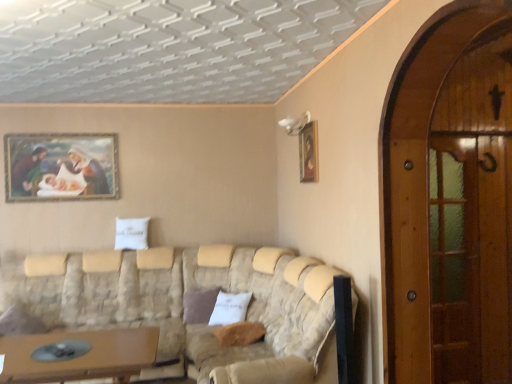
What do you see at coordinates (61, 167) in the screenshot? I see `wooden framed painting at upper left, acting as the 1th picture frame starting from the left` at bounding box center [61, 167].

You are a GUI agent. You are given a task and a screenshot of the screen. Output one action in this format:
    pyautogui.click(x=<x>, y=<y>)
    Task: Click on the wooden screen door at right, which is counted as the first screen door, starting from the right
    The height and width of the screenshot is (384, 512).
    Given the screenshot: What is the action you would take?
    pyautogui.click(x=454, y=258)

Describe the element at coordinates (309, 152) in the screenshot. The height and width of the screenshot is (384, 512). I see `wooden picture frame at upper right, which appears as the 1th picture frame when viewed from the front` at that location.

I want to click on brown plush pillow at center, which is the second pillow from left to right, so click(239, 333).

This screenshot has width=512, height=384. In order to click on beige fabric couch at lower center in this screenshot , I will do `click(265, 316)`.

What is the approximate width of textured beige couch at center?

textured beige couch at center is 2.29 meters wide.

Measure the distance between textured beige couch at center and camera.

They are 2.49 meters apart.

What do you see at coordinates (199, 305) in the screenshot? I see `brown fabric pillow at center, which appears as the second pillow when viewed from the front` at bounding box center [199, 305].

Measure the distance between point (200, 299) and camera.

The depth of point (200, 299) is 4.18 meters.

The image size is (512, 384). Identify the location of wooden framed painting at upper left, the second picture frame positioned from the front. (61, 167).

Is beige fabric couch at lower center bigger than textured beige couch at center?

Actually, beige fabric couch at lower center might be smaller than textured beige couch at center.

Considering the positions of point (323, 280) and point (279, 353), is point (323, 280) closer or farther from the camera than point (279, 353)?

Point (323, 280) is positioned closer to the camera compared to point (279, 353).

Does beige fabric couch at lower center have a greater height compared to textured beige couch at center?

No, beige fabric couch at lower center is not taller than textured beige couch at center.

Is beige fabric couch at lower center positioned with its back to textured beige couch at center?

Yes.

Based on the photo, from the image's perspective, would you say brown plush pillow at center, the second pillow viewed from the back, is shown under wooden screen door at right, which appears as the 2th screen door when viewed from the back?

Correct, brown plush pillow at center, the second pillow viewed from the back, appears lower than wooden screen door at right, which appears as the 2th screen door when viewed from the back, in the image.

Which is behind, brown plush pillow at center, which is the second pillow from left to right, or wooden screen door at right, arranged as the 1th screen door when viewed from the left?

brown plush pillow at center, which is the second pillow from left to right, is more distant.

From a real-world perspective, is brown plush pillow at center, the first pillow positioned from the front, positioned above or below wooden screen door at right, the 2th screen door when ordered from right to left?

brown plush pillow at center, the first pillow positioned from the front, is below wooden screen door at right, the 2th screen door when ordered from right to left.

Between brown plush pillow at center, which is the second pillow from left to right, and wooden screen door at right, which appears as the 2th screen door when viewed from the back, which one has smaller width?

With smaller width is wooden screen door at right, which appears as the 2th screen door when viewed from the back.

Considering the relative sizes of brown wooden table at lower left and textured beige couch at center in the image provided, is brown wooden table at lower left bigger than textured beige couch at center?

Actually, brown wooden table at lower left might be smaller than textured beige couch at center.

From a real-world perspective, between brown wooden table at lower left and textured beige couch at center, who is vertically higher?

In real-world perspective, textured beige couch at center is above.

Can you confirm if brown wooden table at lower left is thinner than textured beige couch at center?

Correct, the width of brown wooden table at lower left is less than that of textured beige couch at center.

Are beige fabric couch at lower center and wooden screen door at right, arranged as the 1th screen door when viewed from the left, beside each other?

beige fabric couch at lower center and wooden screen door at right, arranged as the 1th screen door when viewed from the left, are not in contact.

Is beige fabric couch at lower center turned away from wooden screen door at right, the 2th screen door when ordered from right to left?

No, beige fabric couch at lower center is not facing away from wooden screen door at right, the 2th screen door when ordered from right to left.

Considering the sizes of textured beige couch at center and wooden framed painting at upper left, the second picture frame positioned from the front, in the image, is textured beige couch at center taller or shorter than wooden framed painting at upper left, the second picture frame positioned from the front,?

Clearly, textured beige couch at center is taller compared to wooden framed painting at upper left, the second picture frame positioned from the front.

Does textured beige couch at center have a smaller size compared to wooden framed painting at upper left, arranged as the first picture frame when viewed from the back?

No, textured beige couch at center is not smaller than wooden framed painting at upper left, arranged as the first picture frame when viewed from the back.

Is the surface of textured beige couch at center in direct contact with wooden framed painting at upper left, the second picture frame positioned from the front?

No, textured beige couch at center is not next to wooden framed painting at upper left, the second picture frame positioned from the front.

Is brown wooden table at lower left thinner than brown fabric pillow at center, the 1th pillow positioned from the left?

In fact, brown wooden table at lower left might be wider than brown fabric pillow at center, the 1th pillow positioned from the left.

Based on the photo, which is more to the left, brown wooden table at lower left or brown fabric pillow at center, which appears as the second pillow when viewed from the front?

From the viewer's perspective, brown wooden table at lower left appears more on the left side.

From a real-world perspective, is brown wooden table at lower left physically located above or below brown fabric pillow at center, marked as the 2th pillow in a right-to-left arrangement?

brown wooden table at lower left is situated lower than brown fabric pillow at center, marked as the 2th pillow in a right-to-left arrangement, in the real world.

Which is behind, point (0, 377) or point (196, 322)?

Point (196, 322)

Are brown fabric pillow at center, the 1th pillow positioned from the left, and wooden picture frame at upper right, which appears as the second picture frame when viewed from the back, making contact?

No, brown fabric pillow at center, the 1th pillow positioned from the left, is not touching wooden picture frame at upper right, which appears as the second picture frame when viewed from the back.

Is brown fabric pillow at center, the first pillow positioned from the back, situated inside wooden picture frame at upper right, the 2th picture frame in the left-to-right sequence, or outside?

brown fabric pillow at center, the first pillow positioned from the back, lies outside wooden picture frame at upper right, the 2th picture frame in the left-to-right sequence.

Which object is more forward, brown fabric pillow at center, the 1th pillow positioned from the left, or wooden picture frame at upper right, the 2th picture frame in the left-to-right sequence?

Positioned in front is wooden picture frame at upper right, the 2th picture frame in the left-to-right sequence.

The width and height of the screenshot is (512, 384). I want to click on couch above the textured beige couch at center (from a real-world perspective), so click(x=265, y=316).

This screenshot has width=512, height=384. I want to click on the 2nd screen door in front of the brown plush pillow at center, the first pillow positioned from the front, starting your count from the anchor, so click(421, 175).

When comparing their distances from brown plush pillow at center, the second pillow viewed from the back, does wooden screen door at right, which is counted as the 1th screen door, starting from the back, or wooden picture frame at upper right, which appears as the 1th picture frame when viewed from the front, seem closer?

Based on the image, wooden picture frame at upper right, which appears as the 1th picture frame when viewed from the front, appears to be nearer to brown plush pillow at center, the second pillow viewed from the back.

In the scene shown: Which object lies further to the anchor point wooden screen door at right, which is counted as the 1th screen door, starting from the back, brown wooden table at lower left or wooden framed painting at upper left, acting as the 1th picture frame starting from the left?

wooden framed painting at upper left, acting as the 1th picture frame starting from the left, is positioned further to the anchor wooden screen door at right, which is counted as the 1th screen door, starting from the back.

Estimate the real-world distances between objects in this image. Which object is closer to brown wooden table at lower left, wooden screen door at right, which is counted as the 1th screen door, starting from the back, or wooden picture frame at upper right, which appears as the 1th picture frame when viewed from the front?

wooden picture frame at upper right, which appears as the 1th picture frame when viewed from the front, lies closer to brown wooden table at lower left than the other object.

When comparing their distances from wooden screen door at right, placed as the 1th screen door when sorted from front to back, does brown plush pillow at center, the 1th pillow positioned from the right, or brown wooden table at lower left seem closer?

brown plush pillow at center, the 1th pillow positioned from the right.

Looking at the image, which one is located closer to wooden screen door at right, arranged as the 1th screen door when viewed from the left, wooden framed painting at upper left, the second picture frame positioned from the front, or textured beige couch at center?

textured beige couch at center lies closer to wooden screen door at right, arranged as the 1th screen door when viewed from the left, than the other object.

From the image, which object appears to be farther from brown plush pillow at center, the second pillow viewed from the back, brown wooden table at lower left or wooden picture frame at upper right, which appears as the 1th picture frame when viewed from the front?

Based on the image, wooden picture frame at upper right, which appears as the 1th picture frame when viewed from the front, appears to be further to brown plush pillow at center, the second pillow viewed from the back.

Which object lies further to the anchor point brown wooden table at lower left, beige fabric couch at lower center or wooden picture frame at upper right, which appears as the second picture frame when viewed from the back?

wooden picture frame at upper right, which appears as the second picture frame when viewed from the back, is further to brown wooden table at lower left.

Looking at the image, which one is located further to brown fabric pillow at center, which appears as the second pillow when viewed from the front, beige fabric couch at lower center or wooden framed painting at upper left, acting as the 1th picture frame starting from the left?

wooden framed painting at upper left, acting as the 1th picture frame starting from the left, lies further to brown fabric pillow at center, which appears as the second pillow when viewed from the front, than the other object.

Where is `picture frame between brown wooden table at lower left and wooden screen door at right, arranged as the 1th screen door when viewed from the left, in the horizontal direction`? The image size is (512, 384). picture frame between brown wooden table at lower left and wooden screen door at right, arranged as the 1th screen door when viewed from the left, in the horizontal direction is located at coordinates (309, 152).

Image resolution: width=512 pixels, height=384 pixels. Identify the location of studio couch between brown wooden table at lower left and beige fabric couch at lower center in the horizontal direction. (183, 307).

Locate an element on the screen. This screenshot has width=512, height=384. couch between brown wooden table at lower left and wooden screen door at right, the second screen door when ordered from front to back, in the horizontal direction is located at coordinates (265, 316).

I want to click on studio couch situated between brown wooden table at lower left and wooden picture frame at upper right, the first picture frame when ordered from right to left, from left to right, so click(x=183, y=307).